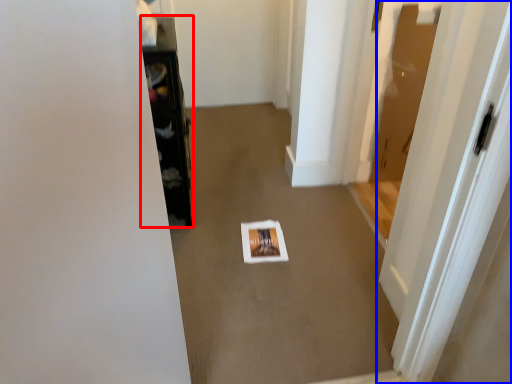
Question: Which point is closer to the camera, furniture (highlighted by a red box) or door (highlighted by a blue box)?

Choices:
 (A) furniture
 (B) door

Answer: (B)